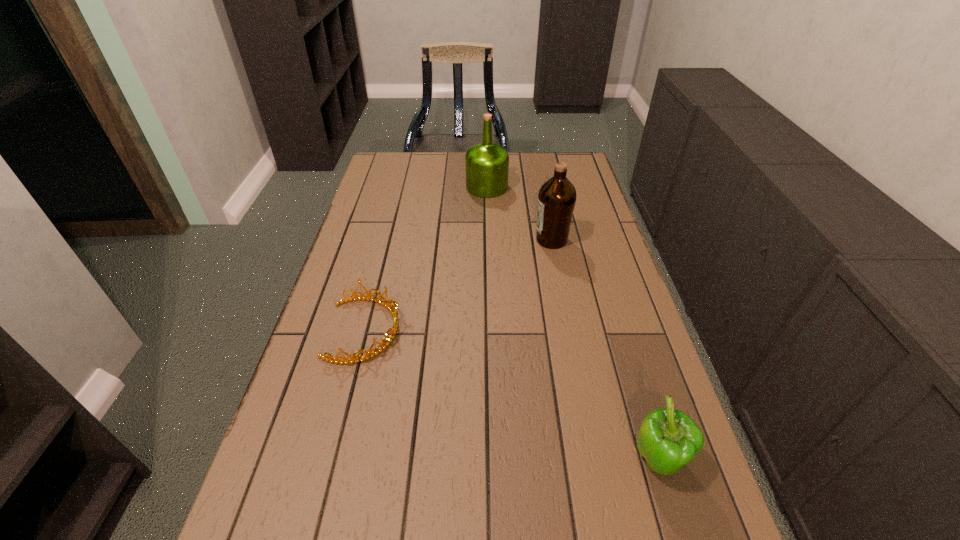
At what (x,y) coordinates should I click in order to perform the action: click on free region located on the label of the third object from left to right. Please return your answer as a coordinate pair (x, y). The image size is (960, 540). Looking at the image, I should click on tap(508, 240).

Locate an element on the screen. The height and width of the screenshot is (540, 960). blank space located 0.070m on the label of the third object from left to right is located at coordinates click(x=511, y=240).

Identify the location of vacant region located 0.060m on the left of the rightmost object. The width and height of the screenshot is (960, 540). (600, 462).

Identify the location of vacant position located on the front-facing side of the tiara. (464, 329).

The height and width of the screenshot is (540, 960). In order to click on object that is at the far edge in this screenshot , I will do `click(487, 163)`.

The image size is (960, 540). Find the location of `object that is at the left edge`. object that is at the left edge is located at coordinates (390, 307).

Where is `olive oil located at the right edge`? Image resolution: width=960 pixels, height=540 pixels. olive oil located at the right edge is located at coordinates (557, 196).

At what (x,y) coordinates should I click in order to perform the action: click on bell pepper positioned at the right edge. Please return your answer as a coordinate pair (x, y). Looking at the image, I should click on (668, 439).

You are a GUI agent. You are given a task and a screenshot of the screen. Output one action in this format:
    pyautogui.click(x=<x>, y=<y>)
    Task: Click on the vacant space at the far edge
    The height and width of the screenshot is (540, 960).
    Given the screenshot: What is the action you would take?
    pyautogui.click(x=422, y=156)

This screenshot has width=960, height=540. I want to click on vacant region at the left edge of the desktop, so click(337, 367).